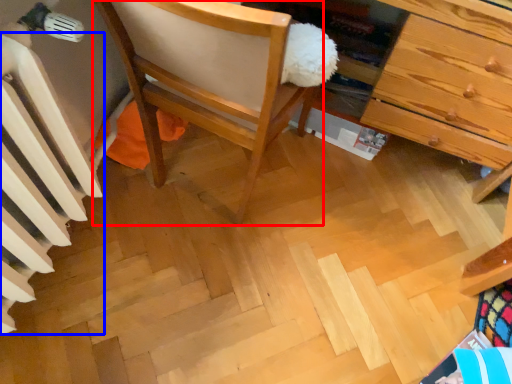
Question: Among these objects, which one is nearest to the camera, chair (highlighted by a red box) or radiator (highlighted by a blue box)?

Choices:
 (A) chair
 (B) radiator

Answer: (B)